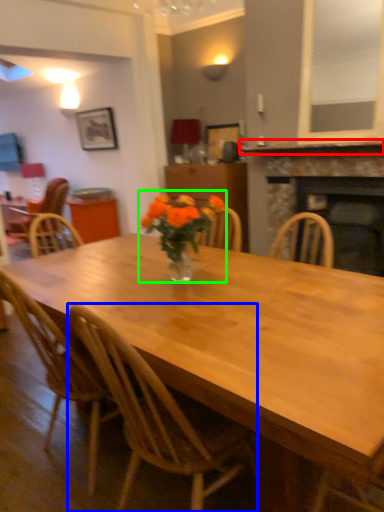
Question: Considering the real-world distances, which object is closest to mantle (highlighted by a red box)? chair (highlighted by a blue box) or floral arrangement (highlighted by a green box).

Choices:
 (A) chair
 (B) floral arrangement

Answer: (B)